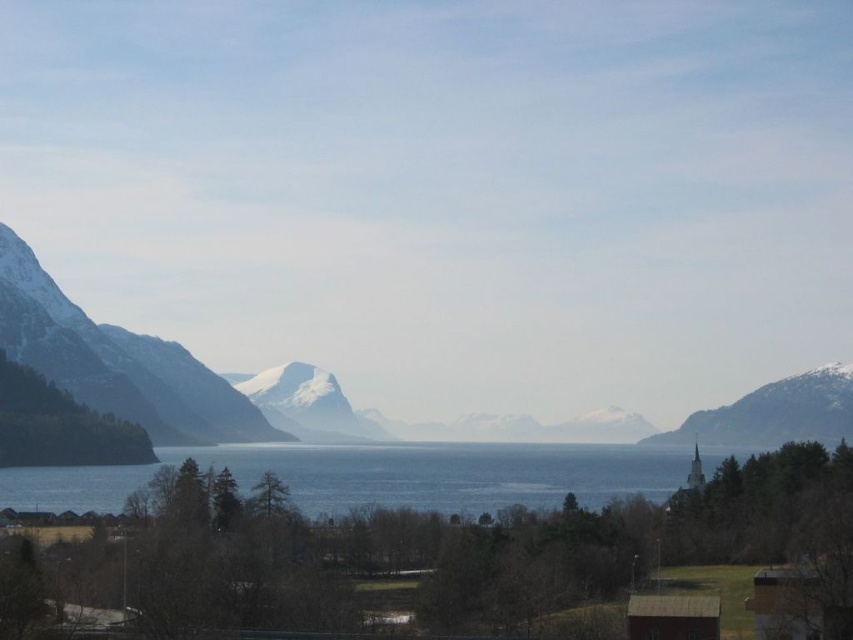
You are a hiker who wants to cross from the snowy rock mountain at left to the blue water at center. Can you safely walk directly between them given the distance?

The distance between the snowy rock mountain at left and the blue water at center is 45.52 meters. Since this distance is manageable for a hiker, you can safely walk directly between them.

From the picture: You are standing at the edge of the fjord and see the point labeled as point [378,476]. Based on the scene description, where is this point located?

The point [378,476] is on blue water at center.